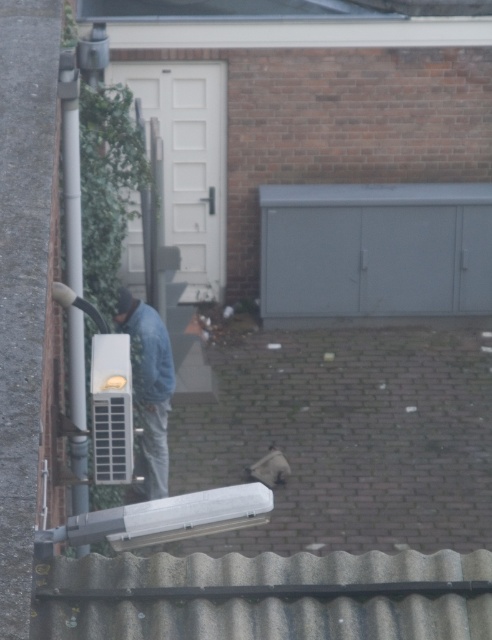
Question: Is smooth gray roof at upper center below white plastic air conditioner at lower left?

Choices:
 (A) no
 (B) yes

Answer: (A)

Question: Which point appears farthest from the camera in this image?

Choices:
 (A) (100, 364)
 (B) (485, 305)
 (C) (155, 392)
 (D) (275, 6)

Answer: (B)

Question: Which point is farther from the camera taking this photo?

Choices:
 (A) (355, 284)
 (B) (149, 497)
 (C) (139, 1)
 (D) (120, 364)

Answer: (A)

Question: In this image, where is gray matte cabinet at upper center located relative to white plastic air conditioner at lower left?

Choices:
 (A) right
 (B) left

Answer: (A)

Question: Which point is closer to the camera?

Choices:
 (A) smooth gray roof at upper center
 (B) gray matte cabinet at upper center
 (C) white matte garage door at upper center
 (D) white plastic air conditioner at lower left

Answer: (D)

Question: Does white matte garage door at upper center appear on the right side of denim jacket at center?

Choices:
 (A) yes
 (B) no

Answer: (B)